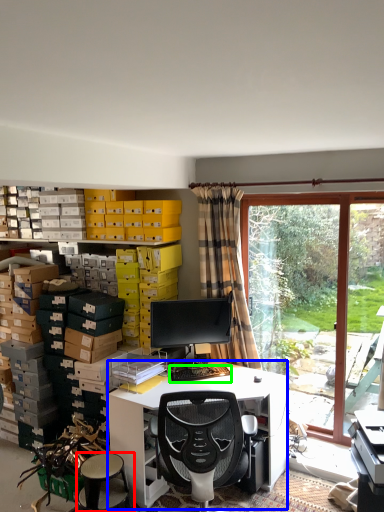
Question: Which object is positioned farthest from stool (highlighted by a red box)? Select from desk (highlighted by a blue box) and computer keyboard (highlighted by a green box).

Choices:
 (A) desk
 (B) computer keyboard

Answer: (B)